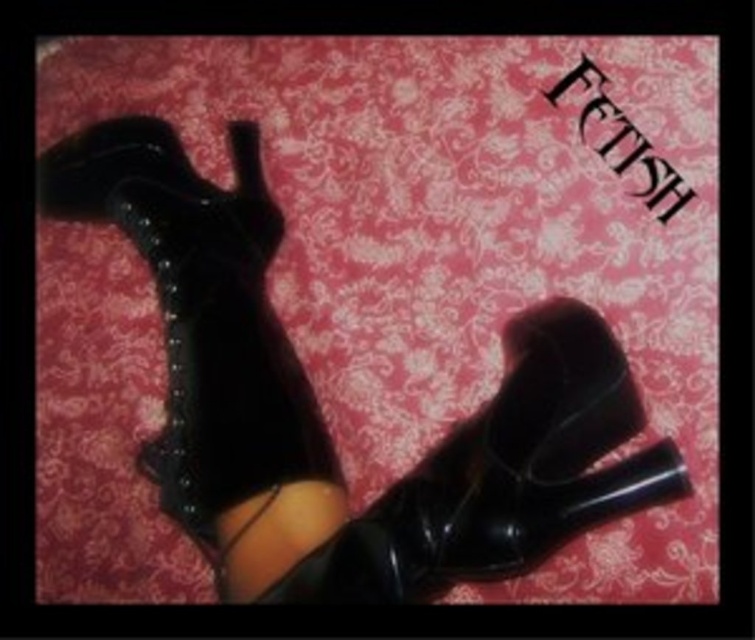
Question: Which object is the farthest from the leather studded boots at left?

Choices:
 (A) shiny patent leather boots at lower right
 (B) black patent leather boot at center

Answer: (B)

Question: Estimate the real-world distances between objects in this image. Which object is farther from the shiny patent leather boots at lower right?

Choices:
 (A) leather studded boots at left
 (B) black patent leather boot at center

Answer: (B)

Question: Is leather studded boots at left smaller than black patent leather boot at center?

Choices:
 (A) yes
 (B) no

Answer: (B)

Question: Is shiny patent leather boots at lower right to the left of black patent leather boot at center from the viewer's perspective?

Choices:
 (A) no
 (B) yes

Answer: (B)

Question: Among these objects, which one is nearest to the camera?

Choices:
 (A) leather studded boots at left
 (B) black patent leather boot at center

Answer: (B)

Question: Is shiny patent leather boots at lower right positioned at the back of leather studded boots at left?

Choices:
 (A) no
 (B) yes

Answer: (A)